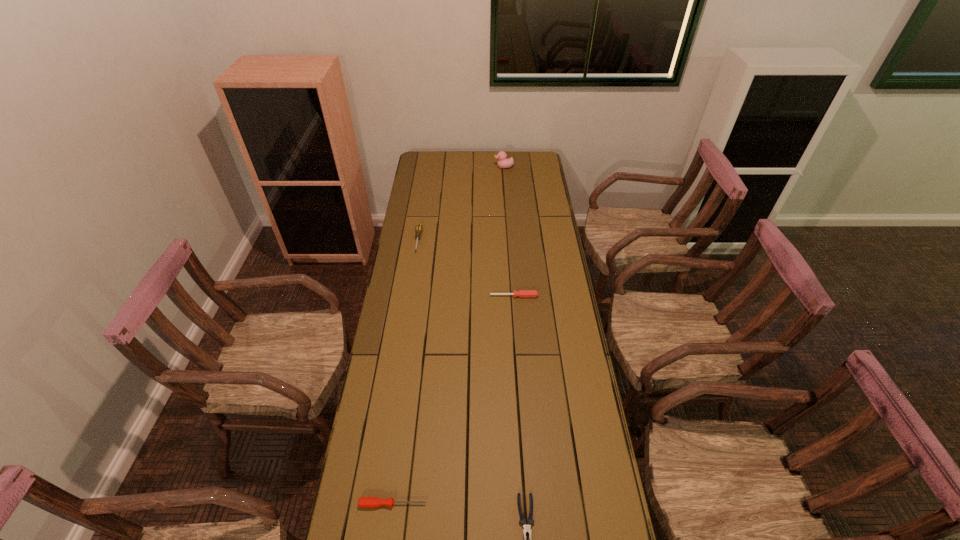
I want to click on duckling, so click(503, 162).

The width and height of the screenshot is (960, 540). I want to click on the farthest object, so click(x=503, y=162).

Where is `the fourth nearest object`? The width and height of the screenshot is (960, 540). the fourth nearest object is located at coordinates (419, 228).

Identify the location of the tallest screwdriver. Image resolution: width=960 pixels, height=540 pixels. (419, 228).

At what (x,y) coordinates should I click in order to perform the action: click on the third tallest object. Please return your answer as a coordinate pair (x, y). The image size is (960, 540). Looking at the image, I should click on (522, 293).

Locate an element on the screen. the second farthest screwdriver is located at coordinates (522, 293).

The image size is (960, 540). I want to click on the nearest screwdriver, so click(x=364, y=502).

This screenshot has height=540, width=960. I want to click on the fourth tallest object, so click(x=364, y=502).

Identify the location of free space located on the front-facing side of the duckling. (447, 167).

This screenshot has width=960, height=540. Find the location of `blank space located 0.130m on the front-facing side of the duckling`. blank space located 0.130m on the front-facing side of the duckling is located at coordinates (471, 167).